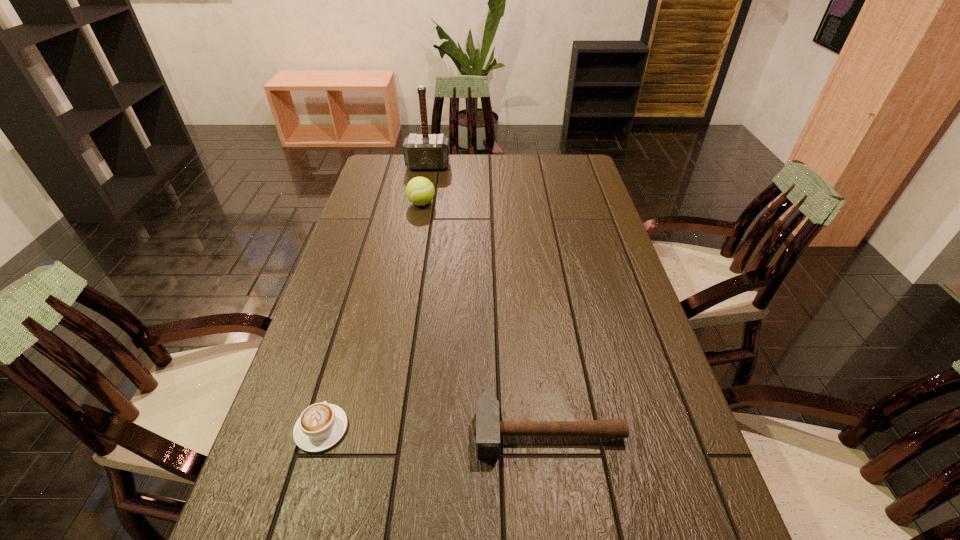
Where is `the left hammer`? the left hammer is located at coordinates (425, 151).

Locate an element on the screen. This screenshot has width=960, height=540. the tallest object is located at coordinates (425, 151).

I want to click on tennis ball, so click(420, 191).

At what (x,y) coordinates should I click in order to perform the action: click on the second farthest object. Please return your answer as a coordinate pair (x, y). The image size is (960, 540). Looking at the image, I should click on pos(420,191).

You are a GUI agent. You are given a task and a screenshot of the screen. Output one action in this format:
    pyautogui.click(x=<x>, y=<y>)
    Task: Click on the shorter hammer
    The height and width of the screenshot is (540, 960).
    Given the screenshot: What is the action you would take?
    pyautogui.click(x=488, y=428)

Image resolution: width=960 pixels, height=540 pixels. I want to click on the nearer hammer, so click(488, 428).

I want to click on cappuccino, so tap(320, 426).

Find the location of a particular element. vacant space situated 0.210m on the front of the tallest object is located at coordinates (421, 200).

Locate an element on the screen. The width and height of the screenshot is (960, 540). free space located 0.310m on the back of the tennis ball is located at coordinates (430, 157).

Identify the location of free region located 0.140m on the striking surface of the rightmost object. Image resolution: width=960 pixels, height=540 pixels. (562, 535).